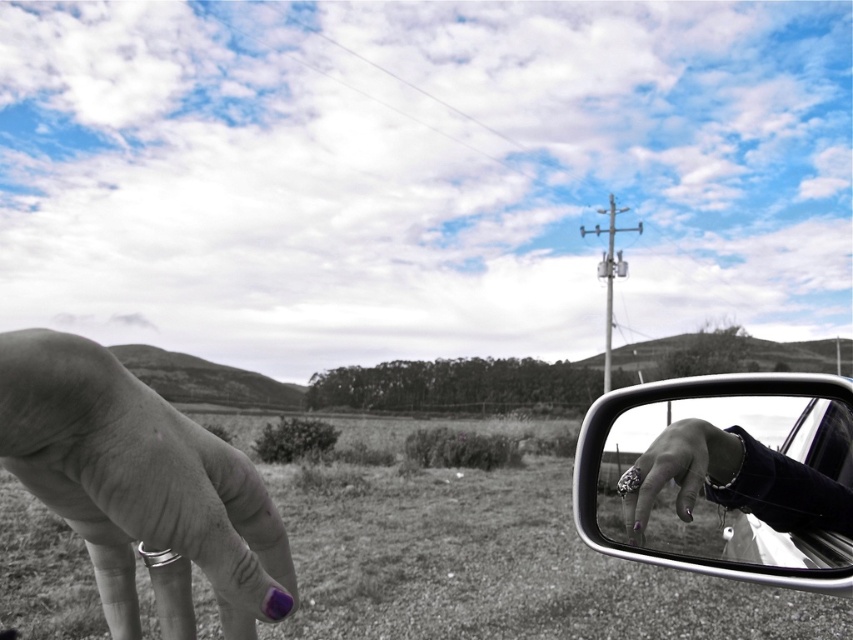
Question: Does purple painted fingernail at center have a lesser width compared to polished silver ring at lower right?

Choices:
 (A) yes
 (B) no

Answer: (B)

Question: Does metallic reflective mirror at right appear on the right side of polished silver ring at lower right?

Choices:
 (A) no
 (B) yes

Answer: (B)

Question: Can you confirm if purple painted fingernail at center is positioned to the left of black leather glove at right?

Choices:
 (A) yes
 (B) no

Answer: (A)

Question: Which object appears farthest from the camera in this image?

Choices:
 (A) metallic reflective mirror at right
 (B) polished silver ring at lower right
 (C) purple painted fingernail at center

Answer: (B)

Question: Based on their relative distances, which object is farther from the polished silver ring at lower right?

Choices:
 (A) metallic reflective mirror at right
 (B) purple painted fingernail at center

Answer: (B)

Question: Which point is farther to the camera?

Choices:
 (A) black leather glove at right
 (B) purple painted fingernail at center

Answer: (A)